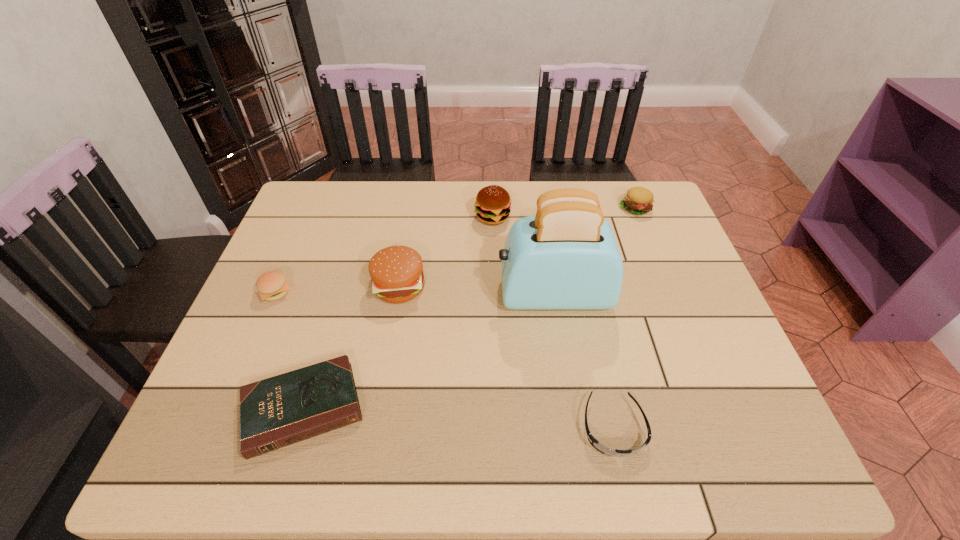
Where is `the tallest object`? the tallest object is located at coordinates (566, 257).

I want to click on the third hamburger from left to right, so click(x=493, y=203).

Find the location of a particular element. The width and height of the screenshot is (960, 540). the second hamburger from left to right is located at coordinates (396, 272).

At what (x,y) coordinates should I click in order to perform the action: click on the rightmost object. Please return your answer as a coordinate pair (x, y). Image resolution: width=960 pixels, height=540 pixels. Looking at the image, I should click on (639, 200).

Identify the location of the leftmost hamburger. (272, 285).

Locate an element on the screen. The width and height of the screenshot is (960, 540). sunglasses is located at coordinates (594, 442).

Find the location of a particular element. Bible is located at coordinates (288, 408).

What are the coordinates of `vacant space situated on the side of the toaster with the lever` in the screenshot? It's located at (355, 294).

Identify the location of vacant space located on the side of the toaster with the lever. (363, 294).

The image size is (960, 540). I want to click on vacant space located 0.070m on the side of the toaster with the lever, so click(469, 294).